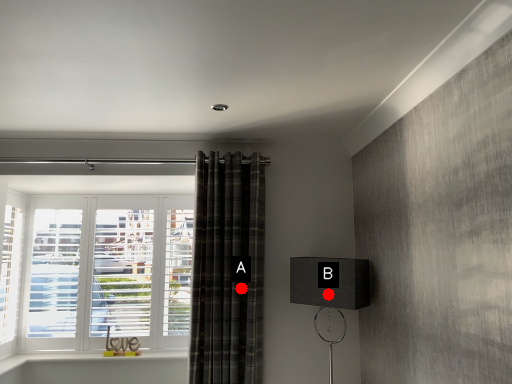
Question: Two points are circled on the image, labeled by A and B beside each circle. Which point is farther to the camera?

Choices:
 (A) A is further
 (B) B is further

Answer: (A)